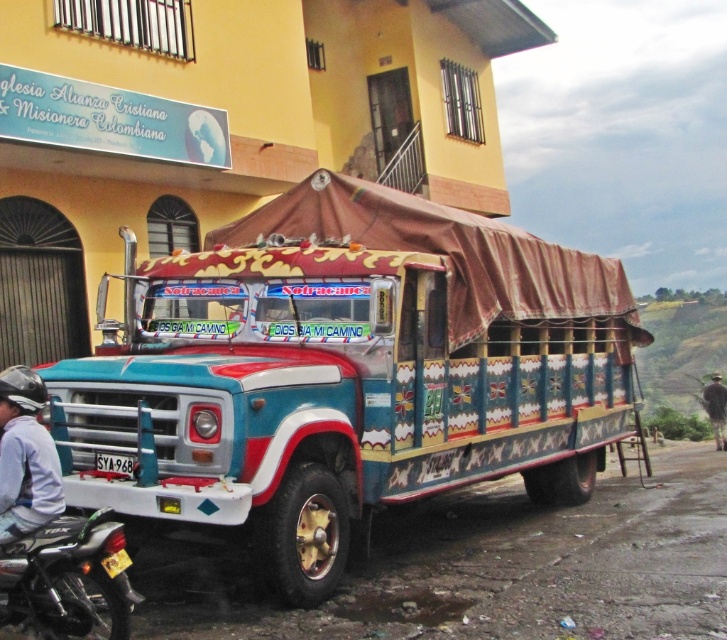
You are a pedestrian standing on the street looking at the bus. You see the brown fabric person at lower right and the black plastic license plate at lower left. Which object is closer to you?

The brown fabric person at lower right is closer to you because the black plastic license plate at lower left is behind it.

You are standing in front of the bus and notice two points marked on the bus. One is at coordinate point [449,371] and the other is at point [95,468]. Which point is closer to your eyes?

Point [449,371] is further to the camera than point [95,468], so the point closer to your eyes is point [95,468].